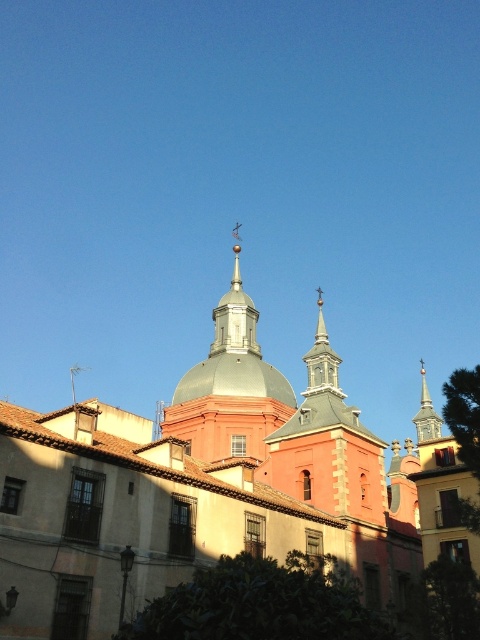
Does smooth gray dome at center have a larger size compared to smooth gray spire at upper right?

No.

Measure the distance between point (237, 499) and camera.

A distance of 45.07 meters exists between point (237, 499) and camera.

Does point (21, 408) come behind point (422, 436)?

No, (21, 408) is in front of (422, 436).

You are a GUI agent. You are given a task and a screenshot of the screen. Output one action in this format:
    pyautogui.click(x=<x>, y=<y>)
    Task: Click on the smooth gray dome at center
    This screenshot has width=480, height=640.
    Given the screenshot: What is the action you would take?
    pyautogui.click(x=196, y=486)

Can you confirm if smooth gray dome at center is bigger than metallic dome at center?

Yes.

Does smooth gray dome at center appear on the right side of metallic dome at center?

Yes, smooth gray dome at center is to the right of metallic dome at center.

The width and height of the screenshot is (480, 640). Describe the element at coordinates (196, 486) in the screenshot. I see `smooth gray dome at center` at that location.

Where is `smooth gray dome at center`? The width and height of the screenshot is (480, 640). smooth gray dome at center is located at coordinates (196, 486).

Can you confirm if metallic dome at center is taller than smooth gray spire at upper right?

Yes.

Can you confirm if metallic dome at center is positioned to the left of smooth gray spire at upper right?

Indeed, metallic dome at center is positioned on the left side of smooth gray spire at upper right.

Does point (279, 401) lie in front of point (427, 390)?

That is True.

Find the location of a particular element. Image resolution: width=480 pixels, height=640 pixels. metallic dome at center is located at coordinates (229, 387).